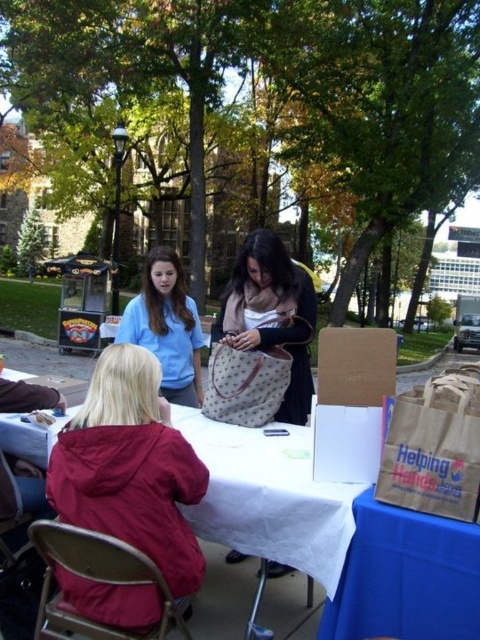
Can you confirm if white fabric picnic table at center is positioned above blue fabric tablecloth at lower right?

Indeed, white fabric picnic table at center is positioned over blue fabric tablecloth at lower right.

In the scene shown: Between white fabric picnic table at center and blue fabric tablecloth at lower right, which one has more height?

white fabric picnic table at center is taller.

Find the location of `white fabric picnic table at center`. white fabric picnic table at center is located at coordinates (264, 524).

Is white fabric picnic table at center smaller than matte red jacket at lower left?

No, white fabric picnic table at center is not smaller than matte red jacket at lower left.

Does point (40, 451) come behind point (194, 538)?

Yes, point (40, 451) is farther from viewer.

Describe the element at coordinates (264, 524) in the screenshot. Image resolution: width=480 pixels, height=640 pixels. I see `white fabric picnic table at center` at that location.

Locate an element on the screen. white fabric picnic table at center is located at coordinates (264, 524).

Is leather-like beige bag at center shorter than matte blue shirt at center?

Yes, leather-like beige bag at center is shorter than matte blue shirt at center.

Is leather-like beige bag at center bigger than matte blue shirt at center?

Actually, leather-like beige bag at center might be smaller than matte blue shirt at center.

Describe the element at coordinates (272, 314) in the screenshot. The height and width of the screenshot is (640, 480). I see `leather-like beige bag at center` at that location.

Identify the location of leather-like beige bag at center. This screenshot has height=640, width=480. (272, 314).